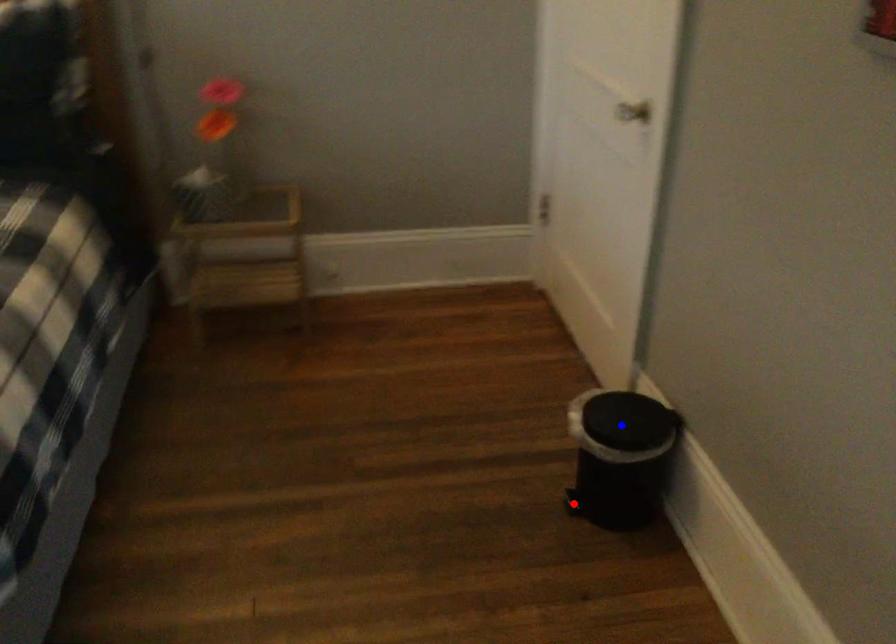
Question: Two points are marked on the image. Which point is closer to the camera?

Choices:
 (A) Blue point is closer.
 (B) Red point is closer.

Answer: (A)